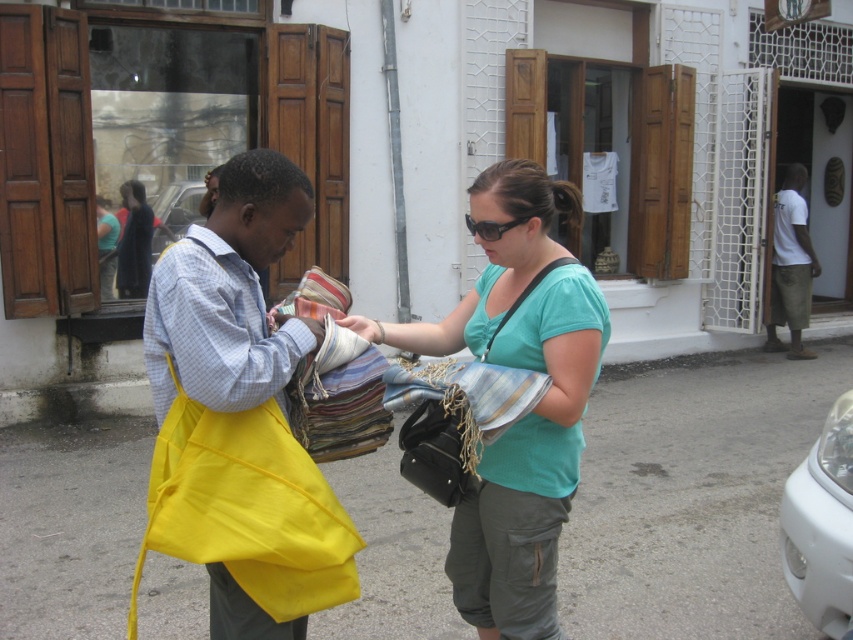
Does point (286, 561) lie in front of point (811, 545)?

That is True.

From the picture: Can you confirm if yellow fabric bag at center is positioned to the left of white glossy car at right?

Correct, you'll find yellow fabric bag at center to the left of white glossy car at right.

Find the location of a particular element. yellow fabric bag at center is located at coordinates (239, 417).

How far apart are teal cotton shirt at center and white cotton shirt at right?

teal cotton shirt at center and white cotton shirt at right are 7.14 meters apart.

Is point (532, 625) farther from viewer compared to point (779, 205)?

No, (532, 625) is closer to viewer.

The height and width of the screenshot is (640, 853). I want to click on teal cotton shirt at center, so (532, 408).

Does white cotton shirt at right have a greater height compared to metallic silver car at center?

Yes.

Based on the photo, is white cotton shirt at right wider than metallic silver car at center?

Yes.

Does point (779, 214) come behind point (192, 189)?

Yes, point (779, 214) is behind point (192, 189).

Locate an element on the screen. This screenshot has width=853, height=640. white cotton shirt at right is located at coordinates (791, 266).